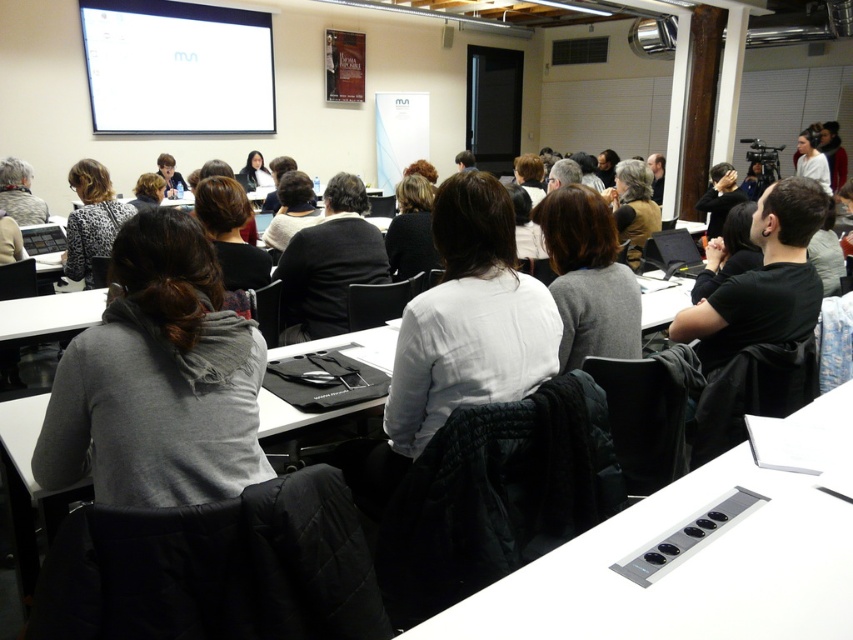
Question: Can you confirm if gray matte sweater at center is positioned above white matte table at lower left?

Choices:
 (A) yes
 (B) no

Answer: (A)

Question: Does white glossy projector screen at upper left come in front of black matte shirt at center?

Choices:
 (A) no
 (B) yes

Answer: (A)

Question: Which point is farther from the camera taking this photo?

Choices:
 (A) (18, 337)
 (B) (132, 211)
 (C) (88, 444)

Answer: (B)

Question: Among these points, which one is farthest from the camera?

Choices:
 (A) (183, 52)
 (B) (798, 262)

Answer: (A)

Question: Does gray matte sweater at center have a larger size compared to white matte table at lower left?

Choices:
 (A) no
 (B) yes

Answer: (A)

Question: Estimate the real-world distances between objects in this image. Which object is closer to the printed fabric jacket at left?

Choices:
 (A) white glossy projector screen at upper left
 (B) gray scarf at center
 (C) black matte shirt at center
 (D) gray matte sweater at center

Answer: (B)